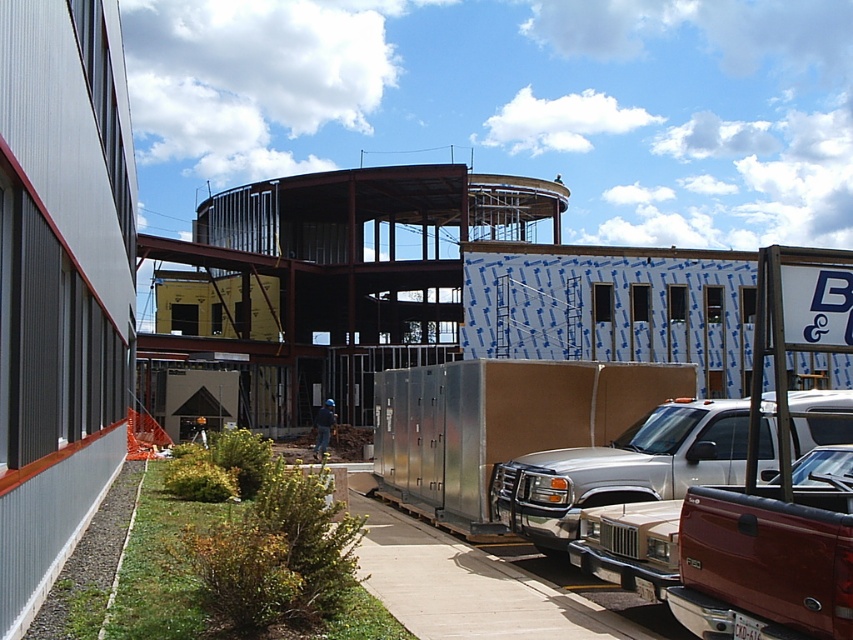
Consider the image. Does silver metallic truck at center appear on the left side of metallic silver truck at lower right?

Correct, you'll find silver metallic truck at center to the left of metallic silver truck at lower right.

Is point (730, 406) positioned after point (840, 456)?

Yes, point (730, 406) is farther from viewer.

What do you see at coordinates (622, 468) in the screenshot? I see `silver metallic truck at center` at bounding box center [622, 468].

What are the coordinates of `silver metallic truck at center` in the screenshot? It's located at (622, 468).

Who is higher up, silver metallic trailer at center or metallic silver truck at lower right?

silver metallic trailer at center

Is silver metallic trailer at center below metallic silver truck at lower right?

No.

Where is `silver metallic trailer at center`? The width and height of the screenshot is (853, 640). silver metallic trailer at center is located at coordinates (498, 424).

Does silver metallic trailer at center have a lesser height compared to silver metallic truck at center?

No, silver metallic trailer at center is not shorter than silver metallic truck at center.

The height and width of the screenshot is (640, 853). Describe the element at coordinates (498, 424) in the screenshot. I see `silver metallic trailer at center` at that location.

Is point (381, 372) less distant than point (728, 400)?

Yes, point (381, 372) is in front of point (728, 400).

This screenshot has width=853, height=640. I want to click on silver metallic trailer at center, so click(498, 424).